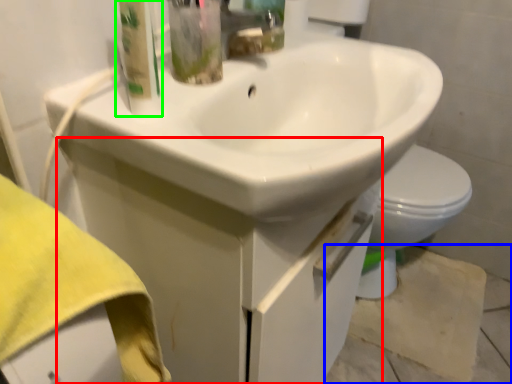
Question: Which object is the farthest from drawer (highlighted by a red box)? Choose among these: concrete (highlighted by a blue box) or cleaning product (highlighted by a green box).

Choices:
 (A) concrete
 (B) cleaning product

Answer: (A)